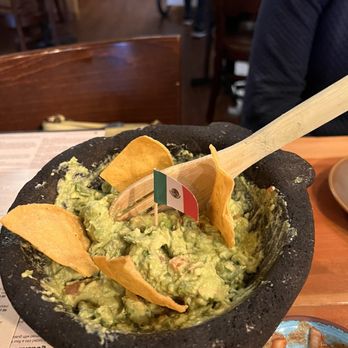
Locate an element on the screen. The image size is (348, 348). table is located at coordinates (332, 294).